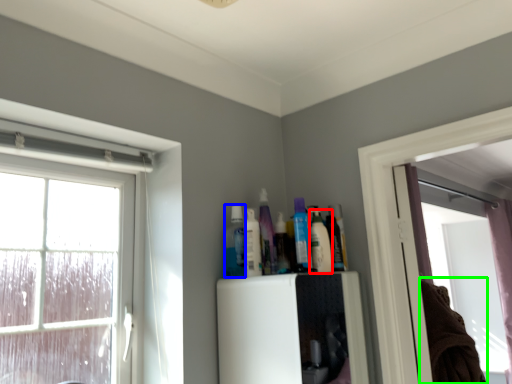
Question: Which is farther away from toiletry (highlighted by a red box)? toiletry (highlighted by a blue box) or laundry (highlighted by a green box)?

Choices:
 (A) toiletry
 (B) laundry

Answer: (B)